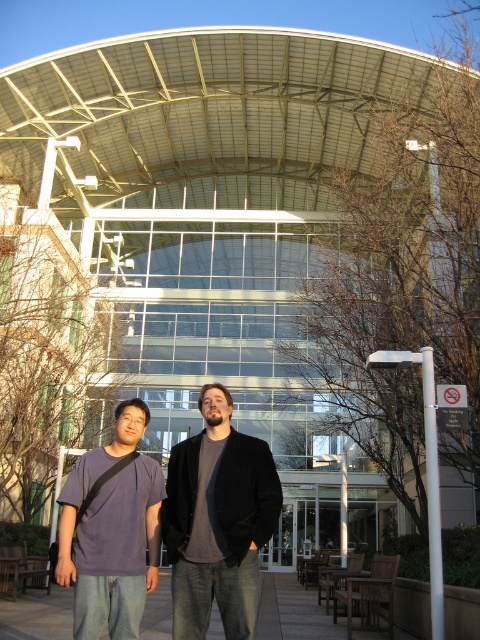
You are standing at the origin point of the coordinate system in the image. You want to find the dark gray fleece jacket at center. In which direction should you move relative to your current position to locate it?

The dark gray fleece jacket at center is located at coordinate point (217,522). Since the origin is at the bottom left corner of the image, you should move to the right and slightly upwards to reach the jacket.